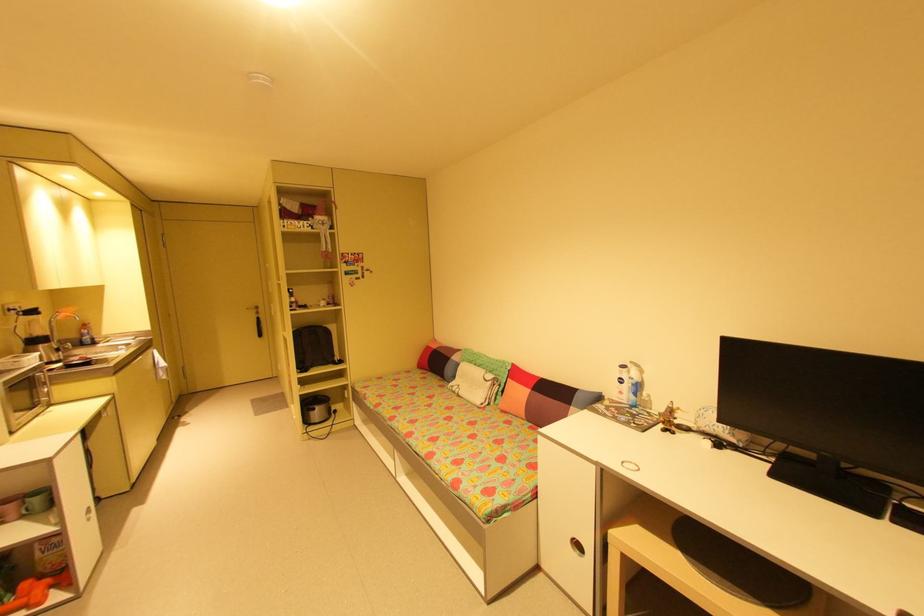
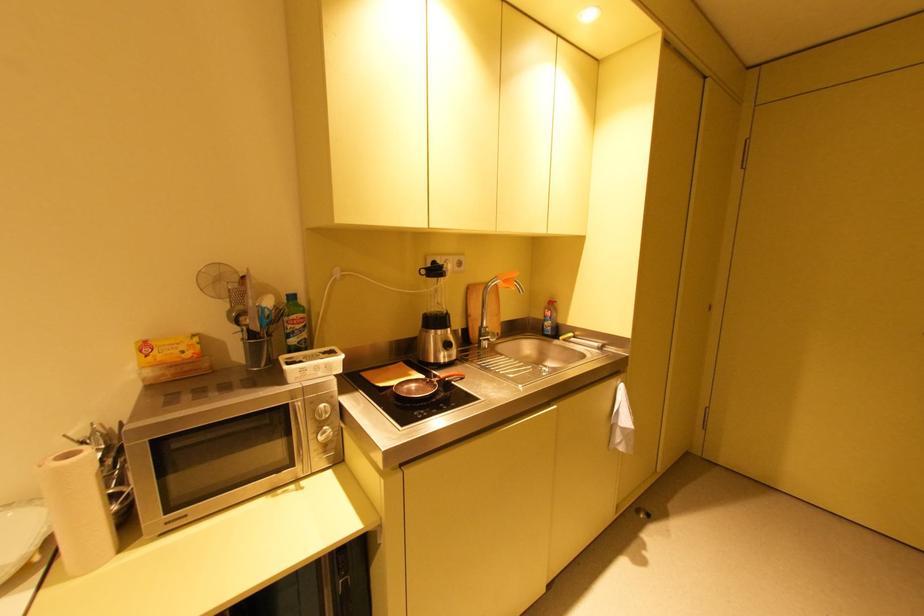
Find the pixel in the second image that matches (42,309) in the first image.

(444, 267)